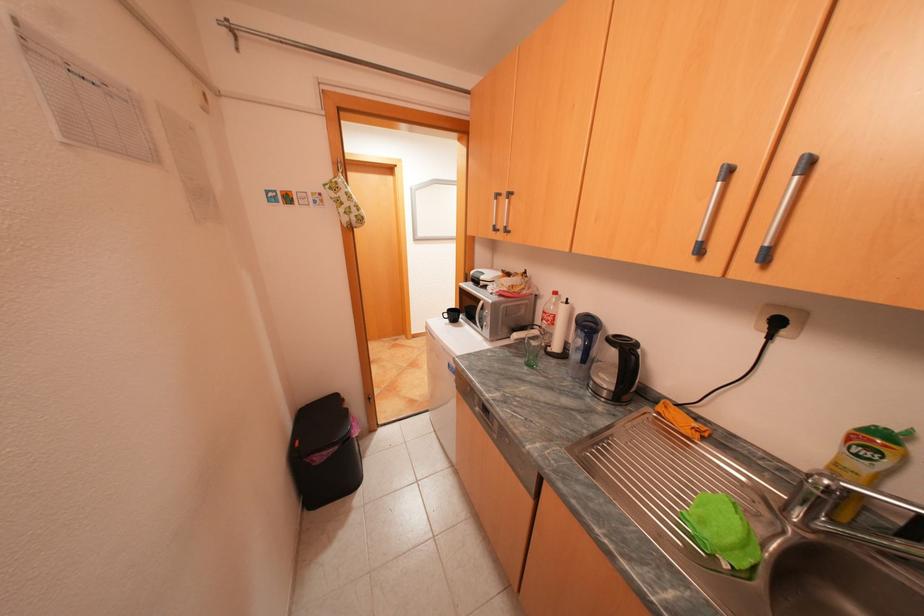
Locate an element on the screen. This screenshot has height=616, width=924. patterned oven mitt is located at coordinates (344, 201).